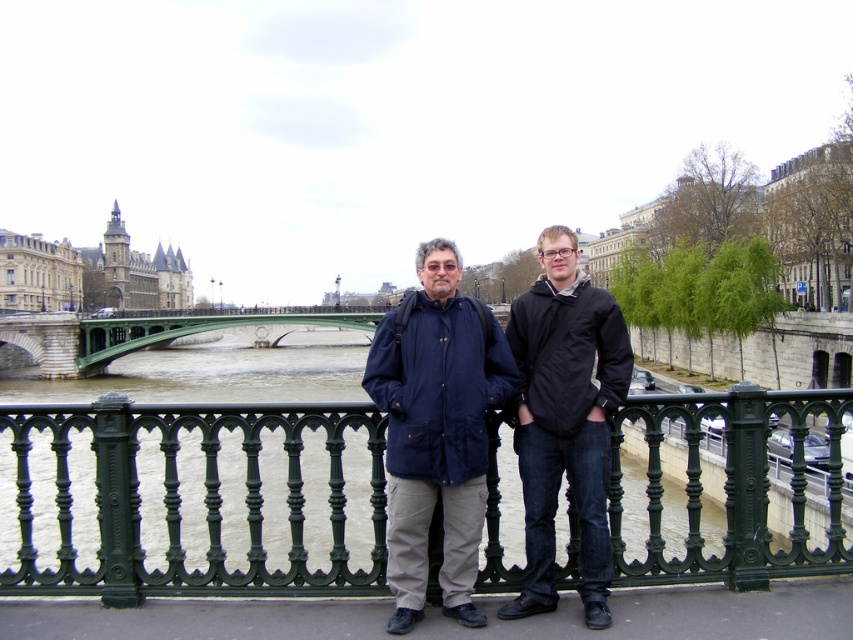
You are a photographer trying to capture a photo of the black matte jacket at center and the stone gothic architecture at upper left. Based on their positions, which object would appear larger in the photo?

The black matte jacket at center is positioned under stone gothic architecture at upper left, so the black matte jacket at center would appear larger in the photo because it is closer to the camera than the stone gothic architecture at upper left.

You are a photographer planning to take a picture of the two people on the bridge. The camera you are using has a rectangular viewfinder. The green wrought iron railing at center is at point (190, 499). If you want to ensure that the railing is centered in your viewfinder, where should you position the viewfinder?

To center the green wrought iron railing at center in the viewfinder, position the center of the viewfinder at the coordinates (190, 499).

You are a photographer trying to capture a wide shot of the scene. You notice the black matte jacket at center and the stone gothic architecture at upper left. Which object would require you to zoom in less to include both in the frame?

The black matte jacket at center has a lesser width compared to the stone gothic architecture at upper left. Therefore, to include both in the frame, you would need to zoom in less because the narrower black matte jacket at center takes up less space, allowing the wider stone gothic architecture at upper left to be captured without requiring excessive zoom.